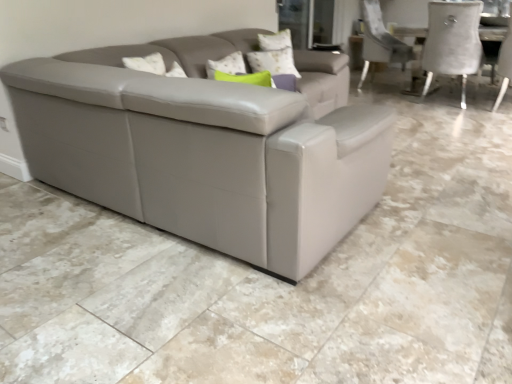
Question: From a real-world perspective, is white textured pillow at upper center physically above white fabric chair at right?

Choices:
 (A) no
 (B) yes

Answer: (B)

Question: Could you tell me if white textured pillow at upper center is turned towards white fabric chair at right?

Choices:
 (A) yes
 (B) no

Answer: (B)

Question: Considering the relative positions of white textured pillow at upper center and white fabric chair at right in the image provided, is white textured pillow at upper center behind white fabric chair at right?

Choices:
 (A) yes
 (B) no

Answer: (B)

Question: From a real-world perspective, does white textured pillow at upper center sit lower than white fabric chair at right?

Choices:
 (A) no
 (B) yes

Answer: (A)

Question: From the image's perspective, is white textured pillow at upper center below white fabric chair at right?

Choices:
 (A) no
 (B) yes

Answer: (B)

Question: Is white textured pillow at upper center closer to the viewer compared to white fabric chair at right?

Choices:
 (A) no
 (B) yes

Answer: (B)

Question: Can you confirm if transparent glass door at upper center is smaller than white fabric chair at right?

Choices:
 (A) no
 (B) yes

Answer: (B)

Question: From a real-world perspective, is transparent glass door at upper center under white fabric chair at right?

Choices:
 (A) yes
 (B) no

Answer: (B)

Question: Does transparent glass door at upper center have a lesser height compared to white fabric chair at right?

Choices:
 (A) no
 (B) yes

Answer: (B)

Question: Is transparent glass door at upper center further to camera compared to white fabric chair at right?

Choices:
 (A) no
 (B) yes

Answer: (B)

Question: Is transparent glass door at upper center outside of white fabric chair at right?

Choices:
 (A) no
 (B) yes

Answer: (B)

Question: Could white fabric chair at right be considered to be inside transparent glass door at upper center?

Choices:
 (A) no
 (B) yes

Answer: (A)

Question: From a real-world perspective, is white fabric chair at right under white textured pillow at upper center?

Choices:
 (A) no
 (B) yes

Answer: (B)